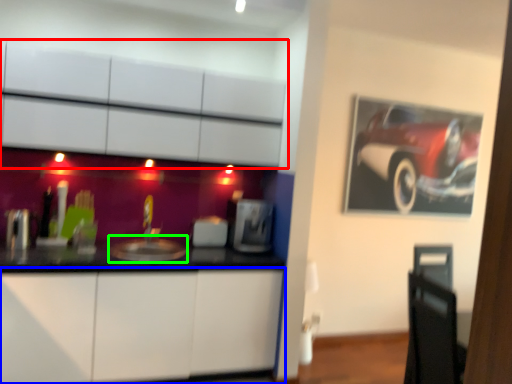
Question: Which object is the closest to the cabinetry (highlighted by a red box)? Choose among these: cabinetry (highlighted by a blue box) or sink (highlighted by a green box).

Choices:
 (A) cabinetry
 (B) sink

Answer: (B)